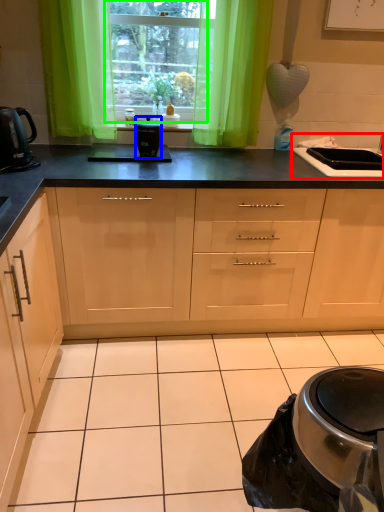
Question: Which is farther away from sink (highlighted by a red box)? kitchen appliance (highlighted by a blue box) or window (highlighted by a green box)?

Choices:
 (A) kitchen appliance
 (B) window

Answer: (B)